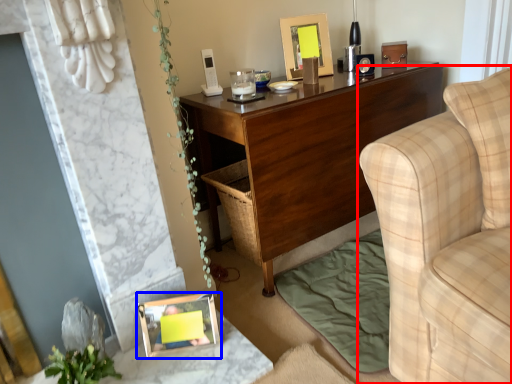
Question: Which object appears closest to the camera in this image, studio couch (highlighted by a red box) or picture frame (highlighted by a blue box)?

Choices:
 (A) studio couch
 (B) picture frame

Answer: (A)